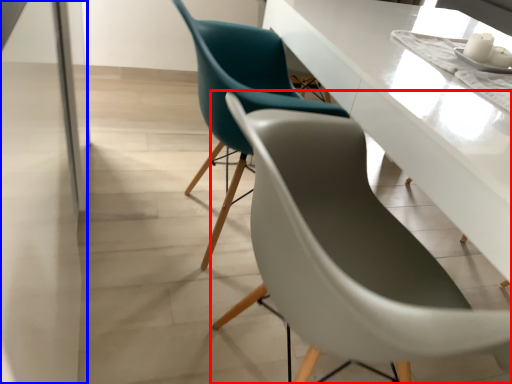
Question: Which of the following is the farthest to the observer, chair (highlighted by a red box) or glass door (highlighted by a blue box)?

Choices:
 (A) chair
 (B) glass door

Answer: (A)